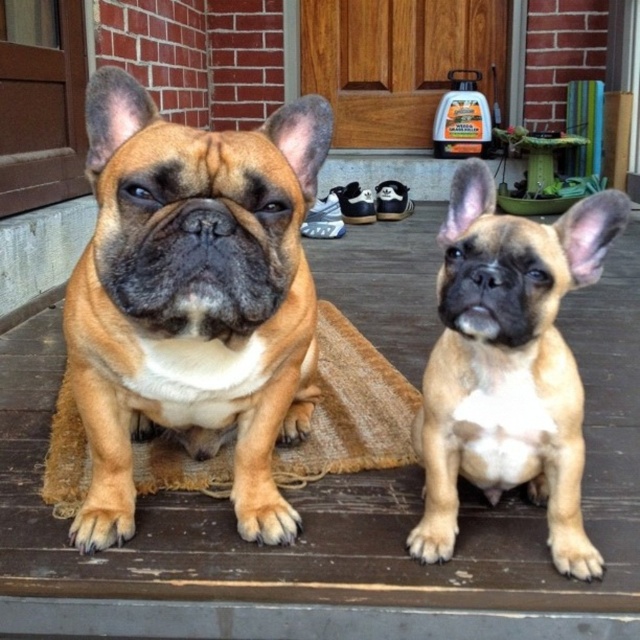
Is point (440, 496) positioned behind point (342, 428)?

No.

Which is above, golden fur puppy at center or burlap mat at center?

Positioned higher is golden fur puppy at center.

The width and height of the screenshot is (640, 640). I want to click on golden fur puppy at center, so click(508, 365).

Which of these two, brown matte dog at center or golden fur puppy at center, stands shorter?

golden fur puppy at center is shorter.

Who is more distant from viewer, (246, 445) or (550, 243)?

Point (246, 445)

The height and width of the screenshot is (640, 640). Identify the location of brown matte dog at center. (193, 300).

You are a GUI agent. You are given a task and a screenshot of the screen. Output one action in this format:
    pyautogui.click(x=<x>, y=<y>)
    Task: Click on the brown matte dog at center
    The image size is (640, 640).
    Given the screenshot: What is the action you would take?
    pyautogui.click(x=193, y=300)

Does point (269, 221) come in front of point (68, 515)?

That is True.

Does brown matte dog at center appear under burlap mat at center?

Incorrect, brown matte dog at center is not positioned below burlap mat at center.

The width and height of the screenshot is (640, 640). I want to click on brown matte dog at center, so click(x=193, y=300).

Find the location of a particular element. Image resolution: width=640 pixels, height=640 pixels. brown matte dog at center is located at coordinates (193, 300).